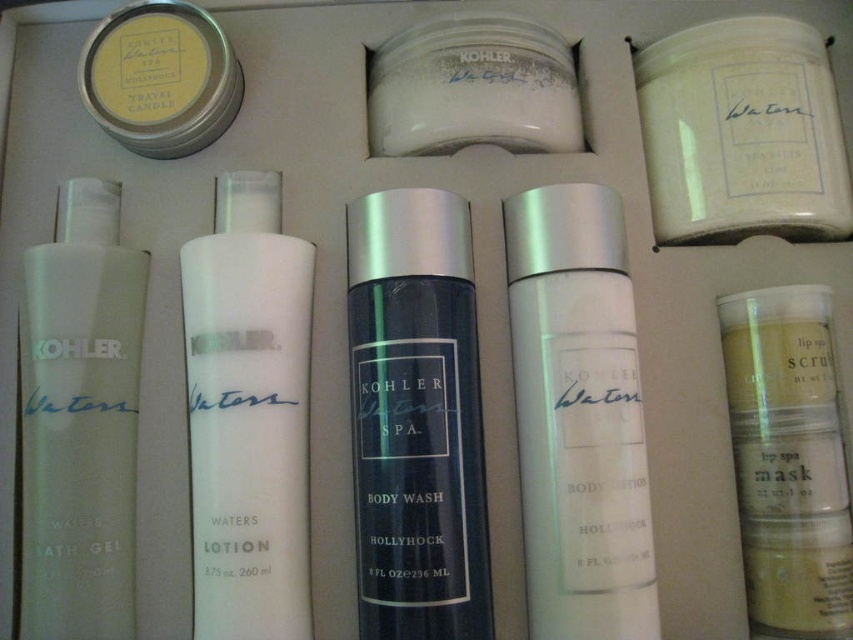
Does white matte candle at upper right appear on the left side of matte yellow candle at upper left?

In fact, white matte candle at upper right is to the right of matte yellow candle at upper left.

Between white matte candle at upper right and matte yellow candle at upper left, which one is positioned higher?

Positioned higher is matte yellow candle at upper left.

Between point (786, 40) and point (195, 54), which one is positioned behind?

The point (786, 40) is more distant.

What are the coordinates of `white matte candle at upper right` in the screenshot? It's located at (741, 132).

Does matte black body wash at center appear on the right side of white matte candle at upper right?

In fact, matte black body wash at center is to the left of white matte candle at upper right.

Does matte black body wash at center come in front of white matte candle at upper right?

Yes, it is in front of white matte candle at upper right.

This screenshot has height=640, width=853. Identify the location of matte black body wash at center. (416, 419).

Which is below, white matte candle at upper right or white matte jar at center?

white matte candle at upper right is below.

Does point (821, 115) come in front of point (389, 145)?

Yes, it is in front of point (389, 145).

Looking at this image, measure the distance between point (759, 218) and camera.

Point (759, 218) and camera are 38.09 inches apart.

Image resolution: width=853 pixels, height=640 pixels. What are the coordinates of `white matte candle at upper right` in the screenshot? It's located at (741, 132).